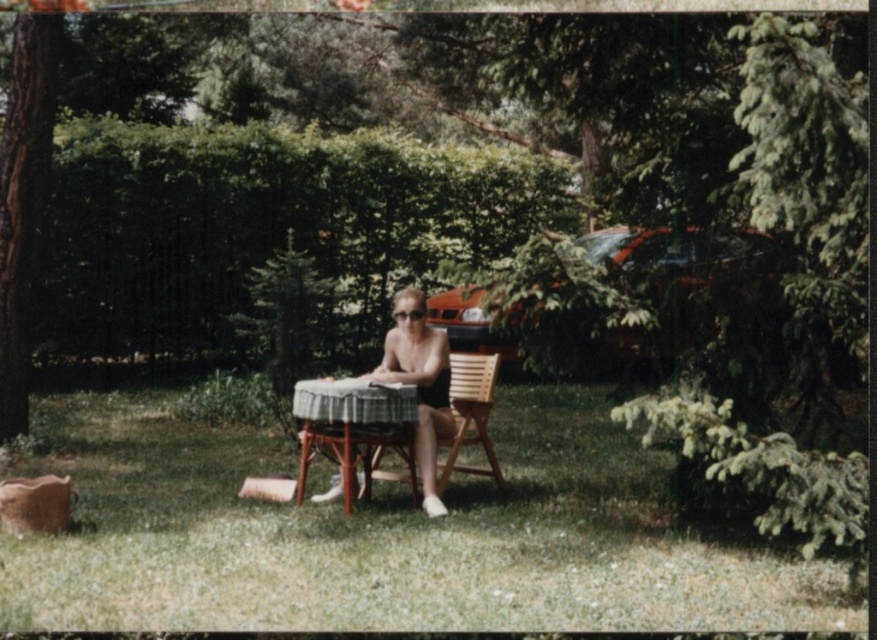
What do you see at coordinates (419, 381) in the screenshot? The height and width of the screenshot is (640, 877). I see `matte plastic woman at center` at bounding box center [419, 381].

Does matte plastic woman at center appear on the left side of wooden chair at center?

Yes, matte plastic woman at center is to the left of wooden chair at center.

Is point (412, 364) more distant than point (472, 408)?

No, (412, 364) is in front of (472, 408).

Image resolution: width=877 pixels, height=640 pixels. I want to click on matte plastic woman at center, so click(419, 381).

Between smooth brown tree trunk at left and matte plastic woman at center, which one appears on the right side from the viewer's perspective?

From the viewer's perspective, matte plastic woman at center appears more on the right side.

Measure the distance between smooth brown tree trunk at left and matte plastic woman at center.

smooth brown tree trunk at left is 3.41 meters away from matte plastic woman at center.

Measure the distance between smooth brown tree trunk at left and camera.

smooth brown tree trunk at left is 8.25 meters from camera.

You are a GUI agent. You are given a task and a screenshot of the screen. Output one action in this format:
    pyautogui.click(x=<x>, y=<y>)
    Task: Click on the smooth brown tree trunk at left
    This screenshot has width=877, height=640.
    Given the screenshot: What is the action you would take?
    pyautogui.click(x=25, y=193)

Which is behind, point (386, 420) or point (404, 381)?

The point (404, 381) is behind.

Measure the distance between point (x=408, y=392) and camera.

The distance of point (x=408, y=392) from camera is 6.68 meters.

Locate an element on the screen. wooden table at center is located at coordinates (353, 426).